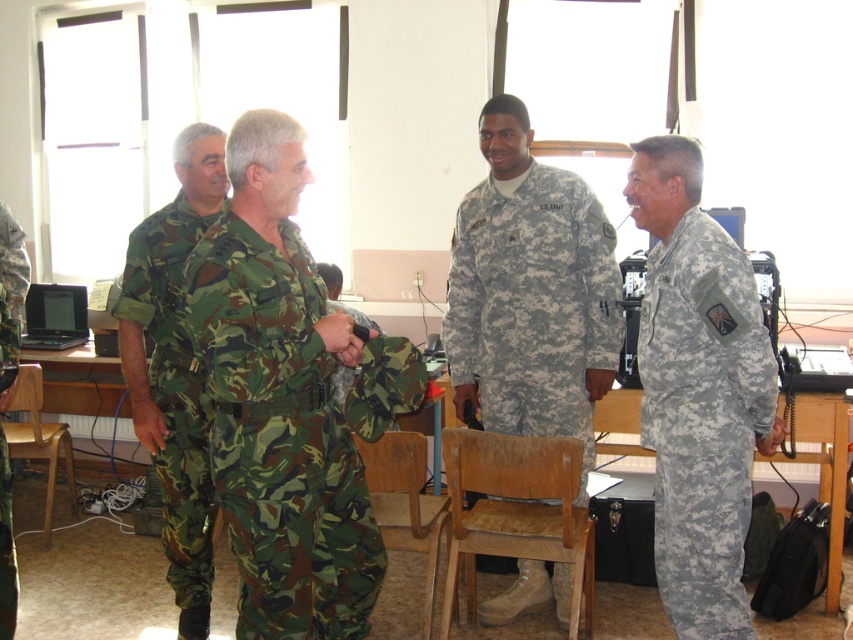
Question: Is worn wood chair at lower center further to the viewer compared to wooden chair at center?

Choices:
 (A) no
 (B) yes

Answer: (A)

Question: Which point appears closest to the camera in this image?

Choices:
 (A) (601, 396)
 (B) (3, 230)

Answer: (A)

Question: Based on their relative distances, which object is nearer to the worn wood chair at lower center?

Choices:
 (A) wooden chair at center
 (B) camouflage fabric uniform at right

Answer: (A)

Question: Can you confirm if camo fabric uniform at center is smaller than camouflage uniform at center?

Choices:
 (A) yes
 (B) no

Answer: (A)

Question: Is camouflage fabric uniform at left to the right of worn wood chair at lower center from the viewer's perspective?

Choices:
 (A) no
 (B) yes

Answer: (A)

Question: Which object is positioned farthest from the worn wood chair at lower center?

Choices:
 (A) wooden chair at lower left
 (B) camouflage uniform at center
 (C) camouflage fabric uniform at left
 (D) camo fabric uniform at center

Answer: (A)